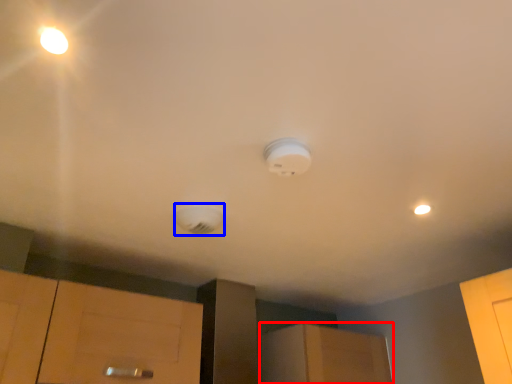
Question: Among these objects, which one is farthest to the camera, cabinetry (highlighted by a red box) or lamp (highlighted by a blue box)?

Choices:
 (A) cabinetry
 (B) lamp

Answer: (A)